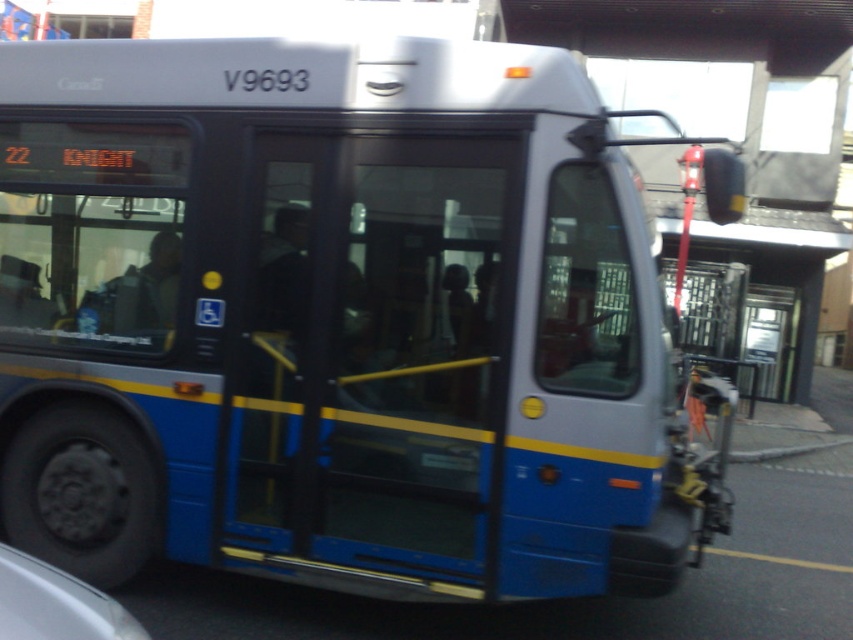
Can you confirm if blue metallic door at center is taller than white glossy car at lower left?

Indeed, blue metallic door at center has a greater height compared to white glossy car at lower left.

Can you confirm if blue metallic door at center is wider than white glossy car at lower left?

Yes.

At what (x,y) coordinates should I click in order to perform the action: click on blue metallic door at center. Please return your answer as a coordinate pair (x, y). The image size is (853, 640). Looking at the image, I should click on (376, 352).